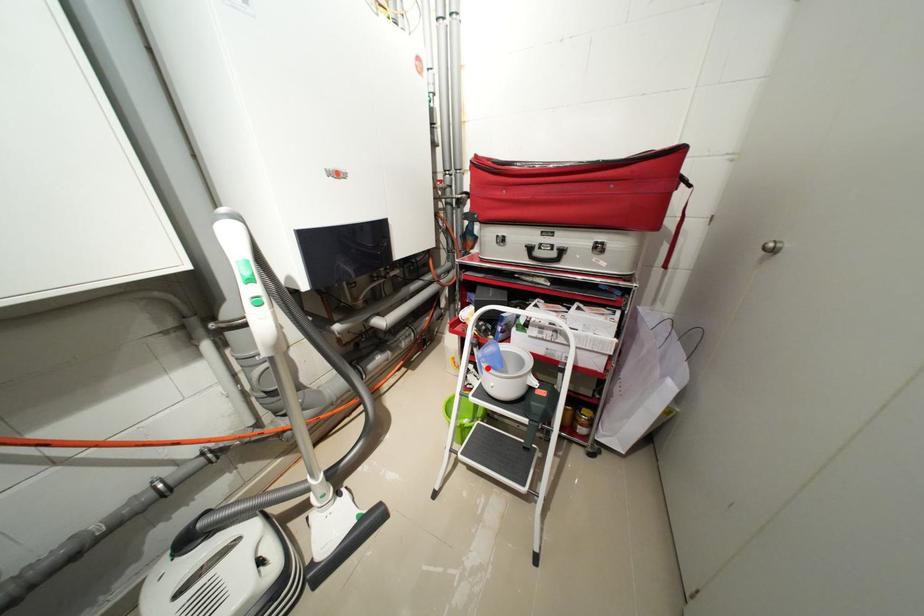
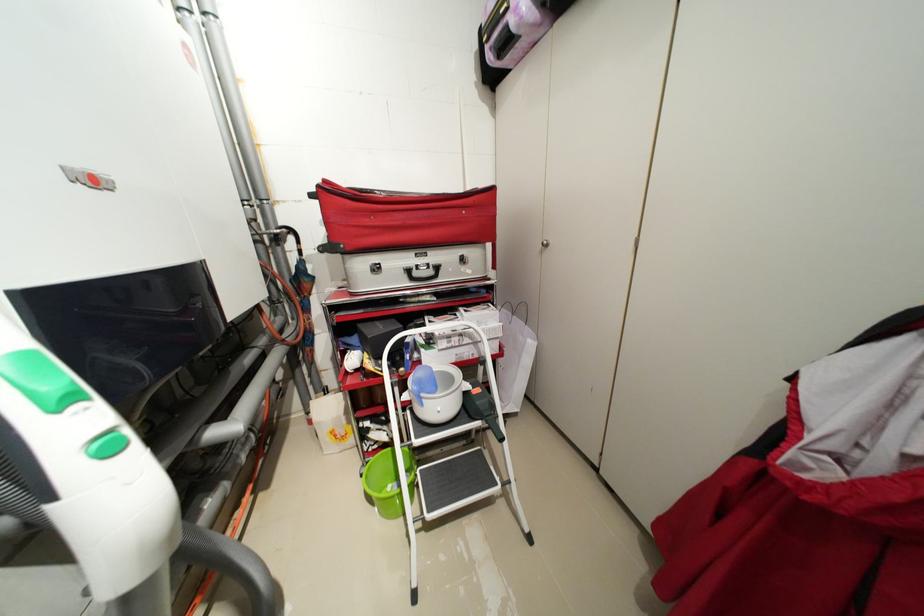
Find the pixel in the second image that matches the highlighted location in the first image.

(428, 400)